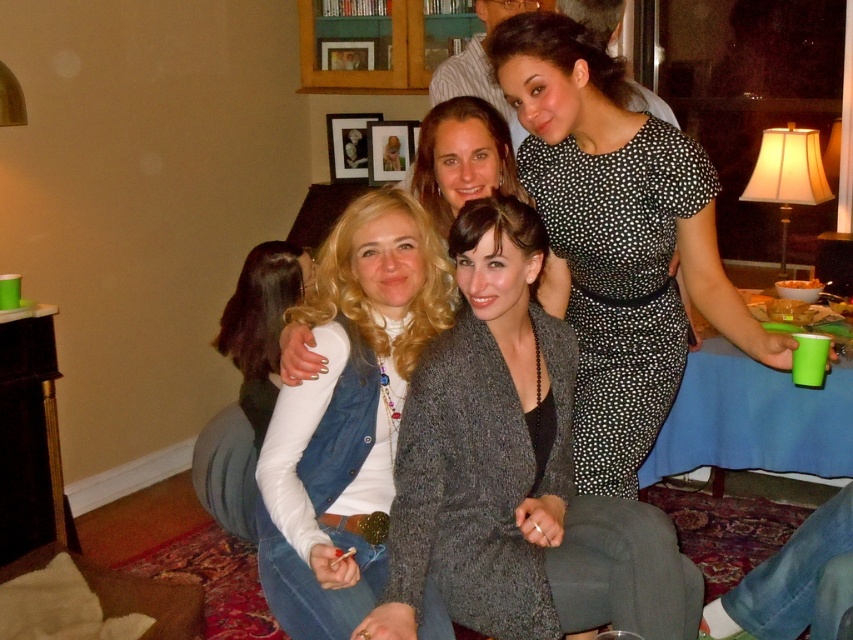
From the picture: Can you confirm if black dotted dress at upper center is positioned below denim vest at center?

Incorrect, black dotted dress at upper center is not positioned below denim vest at center.

Is point (547, 212) farther from viewer compared to point (390, 292)?

Yes, point (547, 212) is farther from viewer.

Where is `black dotted dress at upper center`? The width and height of the screenshot is (853, 640). black dotted dress at upper center is located at coordinates (616, 240).

Is point (602, 138) more distant than point (273, 333)?

No, it is in front of (273, 333).

Does black dotted dress at upper center have a lesser width compared to matte white sweater at center?

Incorrect, black dotted dress at upper center's width is not less than matte white sweater at center's.

Which is in front, point (642, 372) or point (257, 342)?

Point (642, 372) is more forward.

Find the location of a particular element. The width and height of the screenshot is (853, 640). black dotted dress at upper center is located at coordinates (616, 240).

Describe the element at coordinates (347, 413) in the screenshot. I see `denim vest at center` at that location.

Where is `denim vest at center`? denim vest at center is located at coordinates (347, 413).

Is point (338, 465) less distant than point (248, 413)?

Yes, point (338, 465) is in front of point (248, 413).

What are the coordinates of `denim vest at center` in the screenshot? It's located at (347, 413).